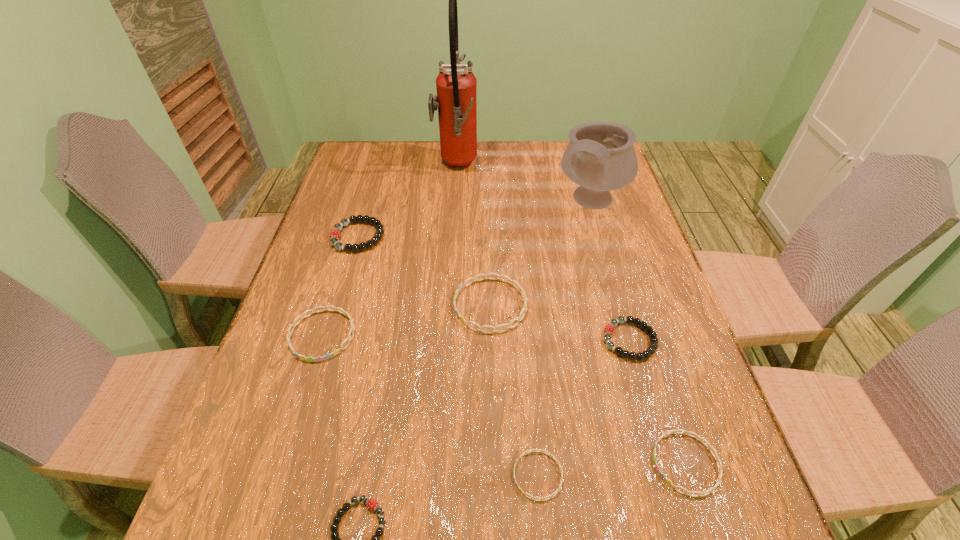
Identify the location of vacant region located on the surface of the third biggest blue bracelet showing star-shaped elements. This screenshot has width=960, height=540. (484, 463).

At what (x,y) coordinates should I click in order to perform the action: click on vacant area located 0.230m on the surface of the third biggest blue bracelet showing star-shaped elements. Please return your answer as a coordinate pair (x, y). Looking at the image, I should click on (527, 463).

The image size is (960, 540). I want to click on vacant area situated on the surface of the third biggest blue bracelet showing star-shaped elements, so click(555, 463).

This screenshot has width=960, height=540. Find the location of `vacant space located 0.140m on the surface of the shortest object showing star-shaped elements`. vacant space located 0.140m on the surface of the shortest object showing star-shaped elements is located at coordinates (435, 475).

At what (x,y) coordinates should I click in order to perform the action: click on vacant space located 0.390m on the surface of the shortest object showing star-shaped elements. Please return your answer as a coordinate pair (x, y). Looking at the image, I should click on (296, 475).

Image resolution: width=960 pixels, height=540 pixels. I want to click on free spot located 0.250m on the surface of the shortest object showing star-shaped elements, so click(x=373, y=475).

This screenshot has height=540, width=960. Find the location of `fire extinguisher that is at the far edge`. fire extinguisher that is at the far edge is located at coordinates (456, 99).

The width and height of the screenshot is (960, 540). In order to click on pottery present at the far edge in this screenshot , I will do `click(600, 157)`.

You are a GUI agent. You are given a task and a screenshot of the screen. Output one action in this format:
    pyautogui.click(x=<x>, y=<y>)
    Task: Click on the pottery that is at the right edge
    This screenshot has height=540, width=960.
    Given the screenshot: What is the action you would take?
    pyautogui.click(x=600, y=157)

Locate an element on the screen. The width and height of the screenshot is (960, 540). object positioned at the far right corner is located at coordinates (600, 157).